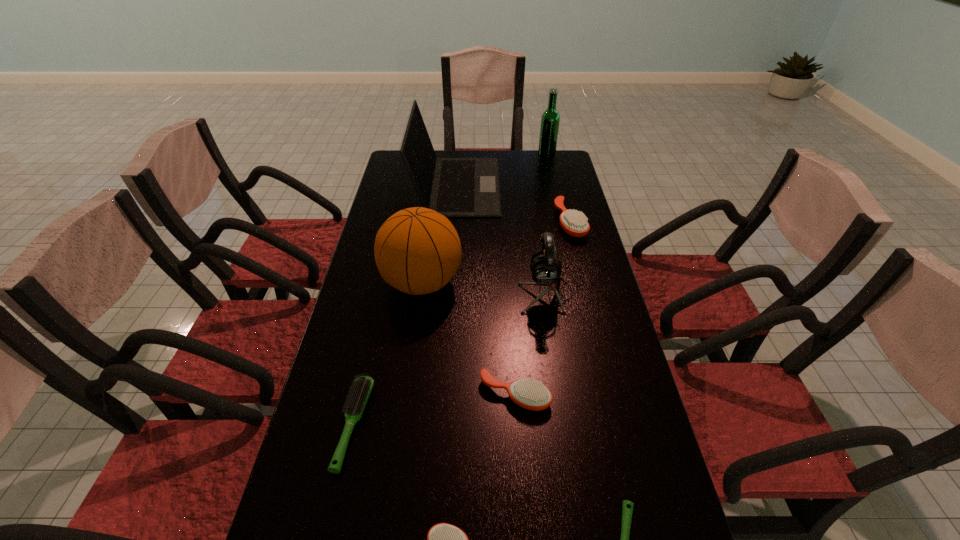
I want to click on free space at the right edge of the desktop, so click(599, 274).

Find the location of a particular element. vacant area that lies between the farthest object and the second tallest hairbrush is located at coordinates (531, 275).

The width and height of the screenshot is (960, 540). Identify the location of vacant area between the leftmost hairbrush and the earphone. (450, 359).

Locate an element on the screen. The image size is (960, 540). vacant area that lies between the second tallest hairbrush and the leftmost hairbrush is located at coordinates (435, 409).

Where is `free space that is in between the basketball and the fourth shortest object`? free space that is in between the basketball and the fourth shortest object is located at coordinates (468, 339).

Locate which object is the closest to the smallest orange hairbrush. Please provide its 2D coordinates. Your answer should be formatted as a tuple, i.e. [(x, y)], where the tuple contains the x and y coordinates of a point satisfying the conditions above.

[(627, 507)]

I want to click on the fifth closest object to the beer bottle, so click(532, 395).

Point out which hairbrush is positioned as the fourth nearest to the green beer bottle. Please provide its 2D coordinates. Your answer should be formatted as a tuple, i.e. [(x, y)], where the tuple contains the x and y coordinates of a point satisfying the conditions above.

[(627, 507)]

I want to click on hairbrush that is the closest to the leftmost hairbrush, so click(x=443, y=539).

Select which orange hairbrush is the closest to the farthest object. Please provide its 2D coordinates. Your answer should be formatted as a tuple, i.e. [(x, y)], where the tuple contains the x and y coordinates of a point satisfying the conditions above.

[(574, 223)]